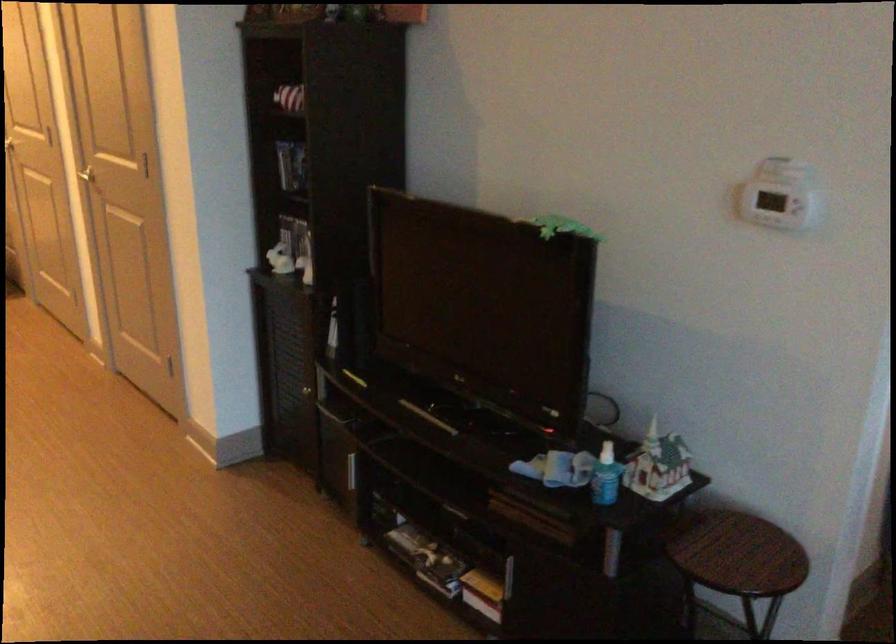
Locate an element on the screen. The width and height of the screenshot is (896, 644). stool sitting surface is located at coordinates (733, 547).